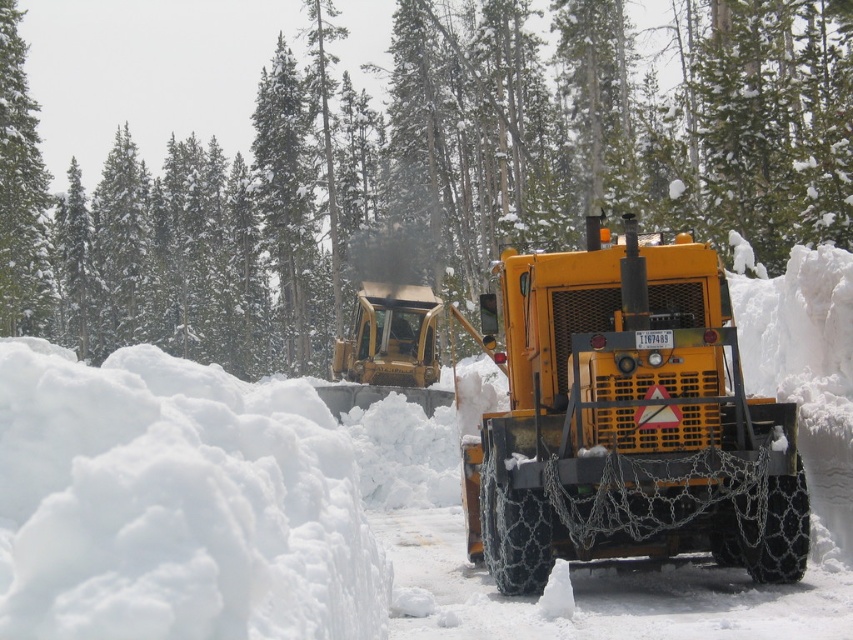
Who is lower down, green textured tree at center or yellow metallic tractor at center?

yellow metallic tractor at center is below.

Measure the distance between point (x=344, y=196) and camera.

Point (x=344, y=196) and camera are 59.37 meters apart.

At what (x,y) coordinates should I click in order to perform the action: click on green textured tree at center. Please return your answer as a coordinate pair (x, y). This screenshot has height=640, width=853. Looking at the image, I should click on (428, 172).

Between green textured tree at center and yellow metallic plow at center, which one has more height?

Standing taller between the two is green textured tree at center.

Which is in front, point (276, 48) or point (402, 324)?

Point (402, 324) is more forward.

Find the location of a particular element. Image resolution: width=853 pixels, height=640 pixels. green textured tree at center is located at coordinates (428, 172).

Does yellow metallic tractor at center appear under yellow metallic plow at center?

Yes.

Between yellow metallic tractor at center and yellow metallic plow at center, which one has less height?

yellow metallic plow at center is shorter.

Which is behind, point (703, 385) or point (426, 387)?

Positioned behind is point (426, 387).

You are a GUI agent. You are given a task and a screenshot of the screen. Output one action in this format:
    pyautogui.click(x=<x>, y=<y>)
    Task: Click on the yellow metallic tractor at center
    This screenshot has width=853, height=640.
    Given the screenshot: What is the action you would take?
    pyautogui.click(x=625, y=420)